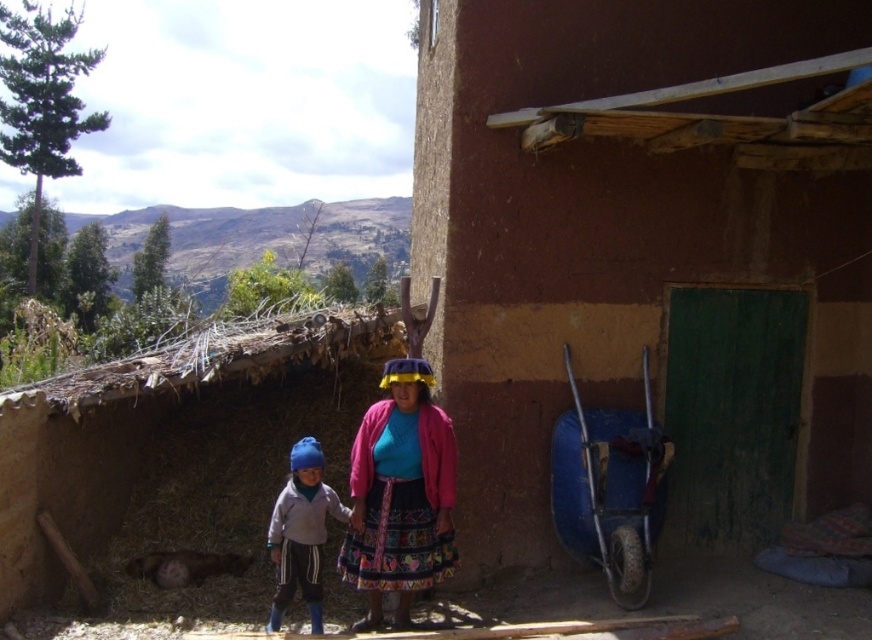
Question: Estimate the real-world distances between objects in this image. Which object is farther from the matte pink sweater at center?

Choices:
 (A) brown mud hut at right
 (B) matte blue hat at lower left

Answer: (A)

Question: Which object appears closest to the camera in this image?

Choices:
 (A) matte blue hat at lower left
 (B) matte pink sweater at center

Answer: (B)

Question: Is matte pink sweater at center closer to camera compared to matte blue hat at lower left?

Choices:
 (A) yes
 (B) no

Answer: (A)

Question: Is brown mud hut at right bigger than matte blue hat at lower left?

Choices:
 (A) yes
 (B) no

Answer: (A)

Question: Does brown mud hut at right have a greater width compared to matte blue hat at lower left?

Choices:
 (A) yes
 (B) no

Answer: (A)

Question: Which of the following is the farthest from the observer?

Choices:
 (A) (523, 464)
 (B) (360, 465)
 (C) (331, 515)

Answer: (A)